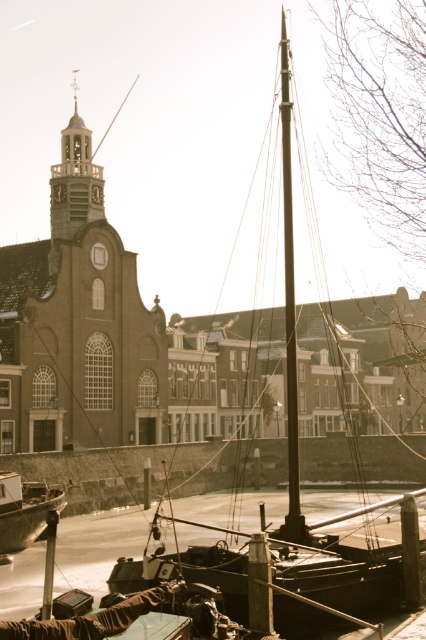
Question: Which point is farther from the camera taking this photo?

Choices:
 (A) (57, 182)
 (B) (290, 486)

Answer: (A)

Question: Does wooden sailboat at center have a lesser width compared to wooden boat at lower left?

Choices:
 (A) no
 (B) yes

Answer: (A)

Question: Is the position of wooden sailboat at center less distant than that of gold textured clock tower at upper left?

Choices:
 (A) yes
 (B) no

Answer: (A)

Question: Which point is farther to the camera?

Choices:
 (A) gold textured clock tower at upper left
 (B) wooden boat at lower left

Answer: (A)

Question: Does wooden sailboat at center have a smaller size compared to gold textured clock tower at upper left?

Choices:
 (A) yes
 (B) no

Answer: (B)

Question: Which object appears farthest from the camera in this image?

Choices:
 (A) wooden boat at lower left
 (B) wooden sailboat at center

Answer: (A)